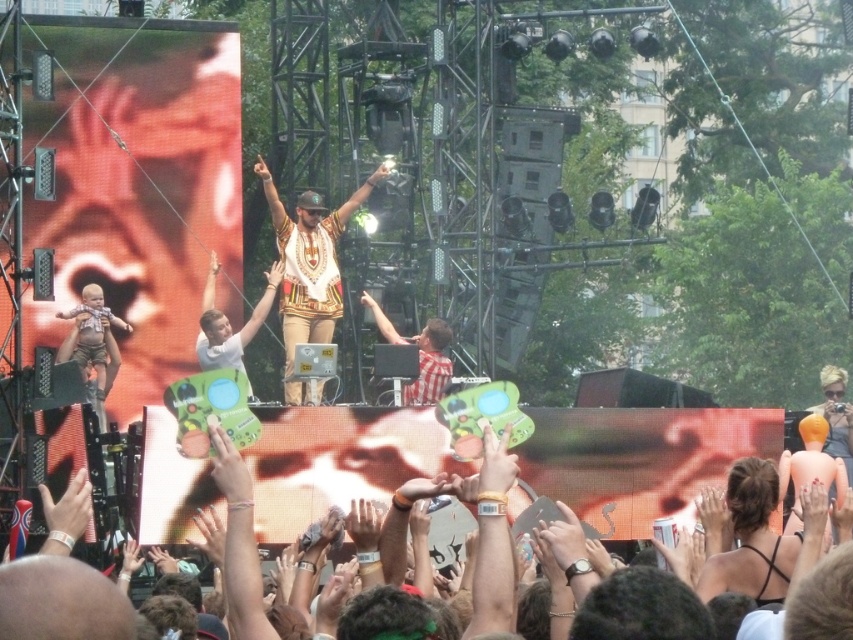
Which of these two, matte green sign at center or white printed shirt at center, stands shorter?

matte green sign at center is shorter.

Is matte green sign at center below white printed shirt at center?

Indeed, matte green sign at center is positioned under white printed shirt at center.

I want to click on matte green sign at center, so click(x=59, y=602).